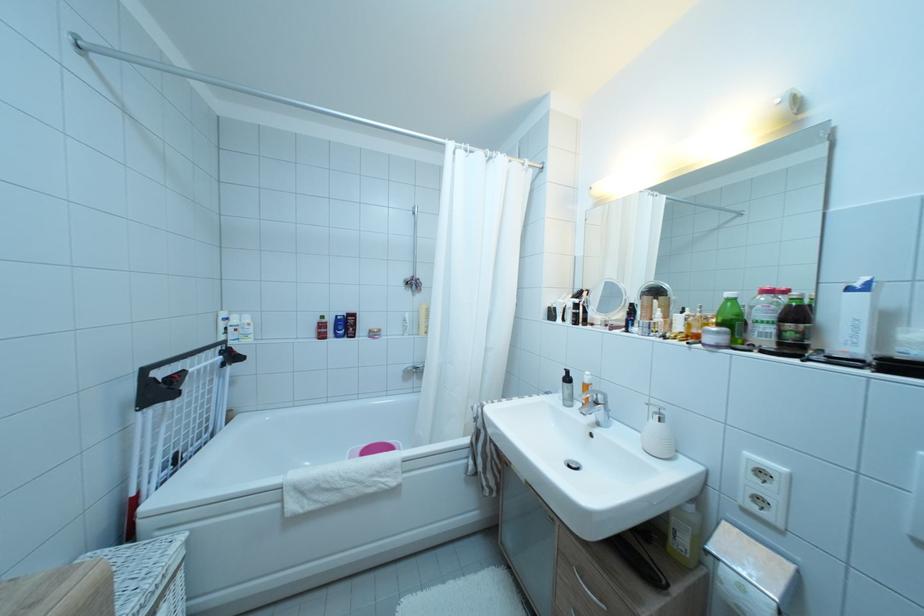
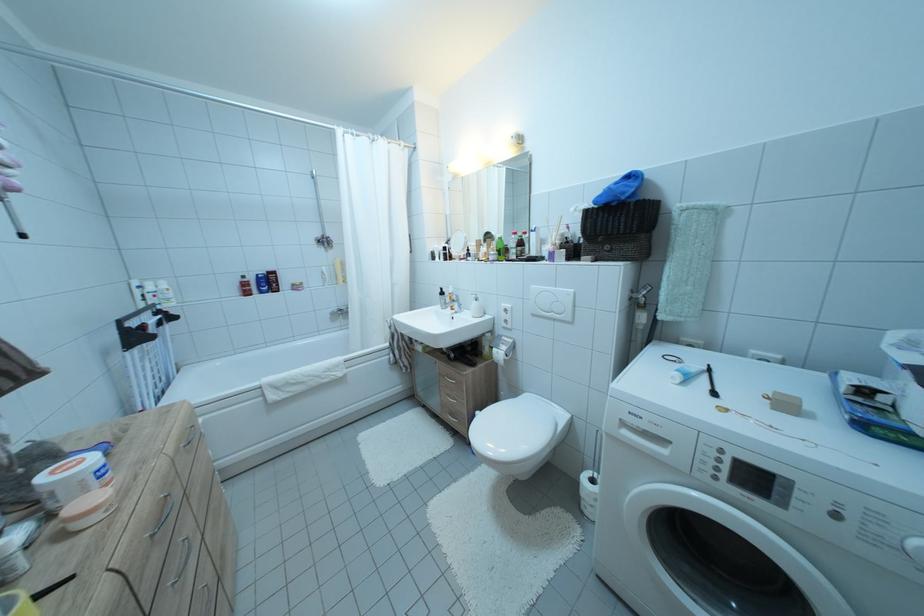
Question: How did the camera likely rotate?

Choices:
 (A) Left
 (B) Right
 (C) Up
 (D) Down

Answer: (B)